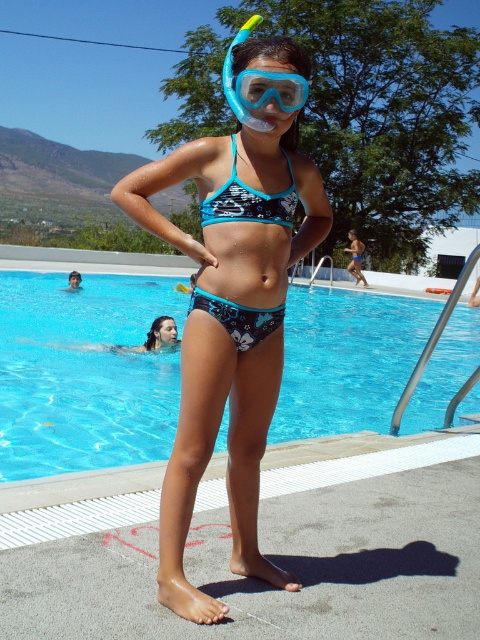
Can you confirm if blue printed bikini bottom at center is wider than teal printed bikini top at center?

Yes.

Is blue printed bikini bottom at center below teal printed bikini top at center?

No.

Who is more distant from viewer, (227, 196) or (252, 205)?

The point (227, 196) is behind.

Image resolution: width=480 pixels, height=640 pixels. What are the coordinates of `blue printed bikini bottom at center` in the screenshot? It's located at (249, 200).

Which is more to the left, blue printed bikini bottom at center or matte blue swimsuit at center?

From the viewer's perspective, blue printed bikini bottom at center appears more on the left side.

Who is more distant from viewer, [263,211] or [348,230]?

The point [348,230] is more distant.

Find the location of `blue printed bikini bottom at center`. blue printed bikini bottom at center is located at coordinates (249, 200).

Who is shorter, transparent blue water at center or blue printed bikini bottom at center?

blue printed bikini bottom at center

Which is in front, point (403, 420) or point (228, 205)?

Point (228, 205) is in front.

Find the location of a particular element. transparent blue water at center is located at coordinates (84, 372).